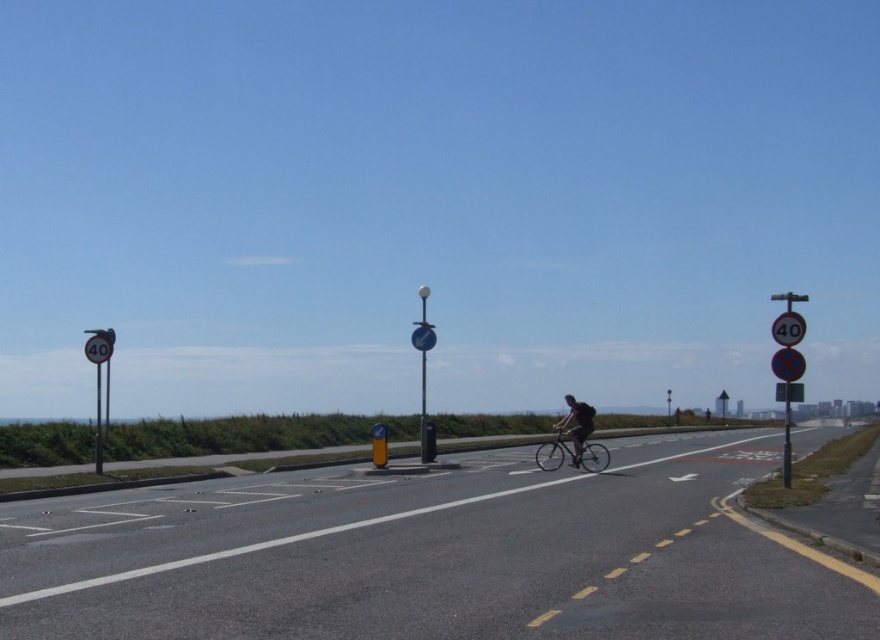
Question: Which point is farther from the camera taking this photo?

Choices:
 (A) (561, 433)
 (B) (440, 552)
 (C) (792, 310)
 (D) (85, 344)

Answer: (A)

Question: Considering the real-world distances, which object is farthest from the blue plastic sign at center?

Choices:
 (A) asphalt road at center
 (B) metallic circular sign at left

Answer: (A)

Question: Which point appears farthest from the camera in this image?

Choices:
 (A) (380, 516)
 (B) (412, 332)
 (C) (94, 348)

Answer: (B)

Question: Can you confirm if shiny metallic bicycle at center is bigger than metallic circular sign at left?

Choices:
 (A) yes
 (B) no

Answer: (A)

Question: Is shiny metallic bicycle at center below metallic circular sign at left?

Choices:
 (A) yes
 (B) no

Answer: (A)

Question: Does shiny metallic bicycle at center have a lesser width compared to blue plastic sign at center?

Choices:
 (A) no
 (B) yes

Answer: (A)